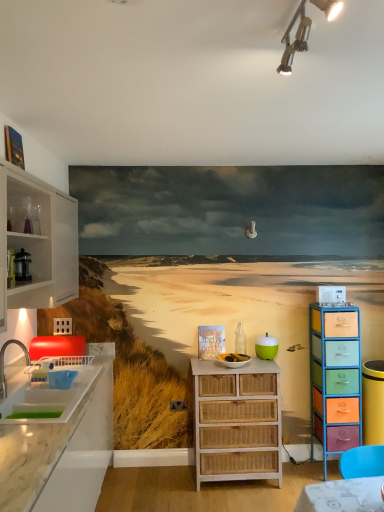
Question: Is metallic track lighting at upper center outside of white glass cabinet at left?

Choices:
 (A) no
 (B) yes

Answer: (B)

Question: From a real-world perspective, is metallic track lighting at upper center under white glass cabinet at left?

Choices:
 (A) yes
 (B) no

Answer: (B)

Question: Does metallic track lighting at upper center lie in front of white glass cabinet at left?

Choices:
 (A) yes
 (B) no

Answer: (A)

Question: Is metallic track lighting at upper center touching white glass cabinet at left?

Choices:
 (A) no
 (B) yes

Answer: (A)

Question: Considering the relative sizes of metallic track lighting at upper center and white glass cabinet at left in the image provided, is metallic track lighting at upper center wider than white glass cabinet at left?

Choices:
 (A) no
 (B) yes

Answer: (B)

Question: From their relative heights in the image, would you say white wicker basket at center, the 3th appliance from the top, is taller or shorter than metallic silver coffee pot at left, arranged as the 3th appliance when viewed from the right?

Choices:
 (A) tall
 (B) short

Answer: (B)

Question: Is white wicker basket at center, the 3th appliance from the top, spatially inside metallic silver coffee pot at left, which ranks as the first appliance in front-to-back order, or outside of it?

Choices:
 (A) outside
 (B) inside

Answer: (A)

Question: From the image's perspective, is white wicker basket at center, placed as the first appliance when sorted from bottom to top, located above or below metallic silver coffee pot at left, the 1th appliance when ordered from top to bottom?

Choices:
 (A) above
 (B) below

Answer: (B)

Question: In the image, is white wicker basket at center, which is the 2th appliance in left-to-right order, on the left side or the right side of metallic silver coffee pot at left, which is the 3th appliance from back to front?

Choices:
 (A) right
 (B) left

Answer: (A)

Question: Considering the positions of point (354, 403) and point (322, 291), is point (354, 403) closer or farther from the camera than point (322, 291)?

Choices:
 (A) farther
 (B) closer

Answer: (B)

Question: Is multicolored wicker chest of drawers at right, marked as the first chest of drawers in a right-to-left arrangement, wider or thinner than white plastic microwave at upper right, arranged as the 1th appliance when viewed from the back?

Choices:
 (A) wide
 (B) thin

Answer: (A)

Question: From the image's perspective, is multicolored wicker chest of drawers at right, marked as the first chest of drawers in a right-to-left arrangement, positioned above or below white plastic microwave at upper right, arranged as the 1th appliance when viewed from the back?

Choices:
 (A) below
 (B) above

Answer: (A)

Question: Based on their positions, is multicolored wicker chest of drawers at right, marked as the first chest of drawers in a right-to-left arrangement, located to the left or right of white plastic microwave at upper right, arranged as the 1th appliance when viewed from the back?

Choices:
 (A) left
 (B) right

Answer: (B)

Question: Considering the positions of white wicker chest of drawers at center, acting as the first chest of drawers starting from the left, and green matte apple at center in the image, is white wicker chest of drawers at center, acting as the first chest of drawers starting from the left, bigger or smaller than green matte apple at center?

Choices:
 (A) small
 (B) big

Answer: (B)

Question: Is white wicker chest of drawers at center, positioned as the second chest of drawers in right-to-left order, in front of or behind green matte apple at center in the image?

Choices:
 (A) behind
 (B) front

Answer: (B)